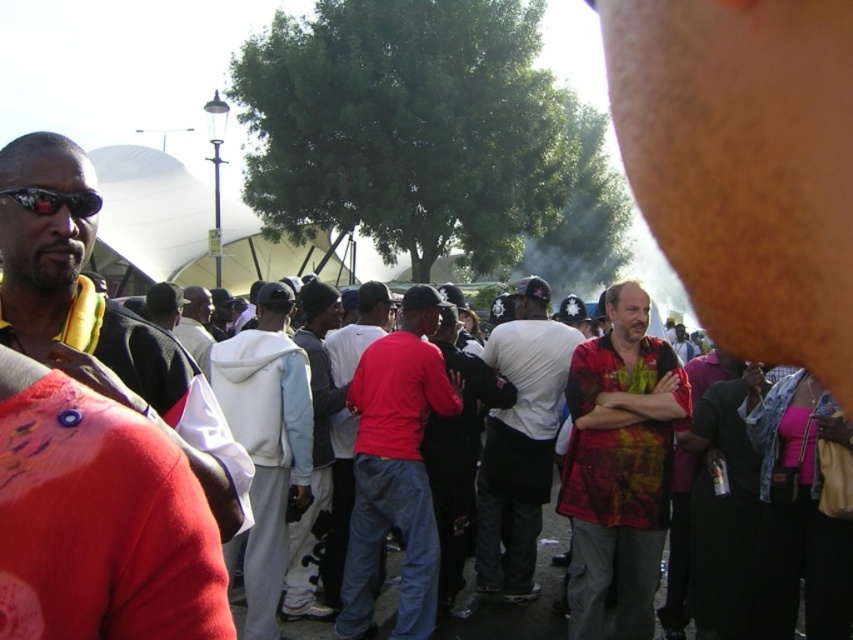
Question: Can you confirm if printed cotton shirt at center is smaller than red hoodie at center?

Choices:
 (A) yes
 (B) no

Answer: (A)

Question: Does matte black jacket at left have a smaller size compared to red matte shirt at center?

Choices:
 (A) yes
 (B) no

Answer: (A)

Question: Which of the following is the closest to the observer?

Choices:
 (A) [x=495, y=592]
 (B) [x=194, y=312]
 (C) [x=386, y=332]

Answer: (A)

Question: Can you confirm if red matte shirt at center is smaller than matte red shirt at center?

Choices:
 (A) yes
 (B) no

Answer: (B)

Question: Estimate the real-world distances between objects in this image. Which object is closer to the matte red shirt at center?

Choices:
 (A) white matte shirt at center
 (B) printed cotton shirt at center
 (C) matte black jacket at left

Answer: (A)

Question: Based on their relative distances, which object is farther from the matte black sunglasses at left?

Choices:
 (A) matte black jacket at left
 (B) matte red shirt at center

Answer: (B)